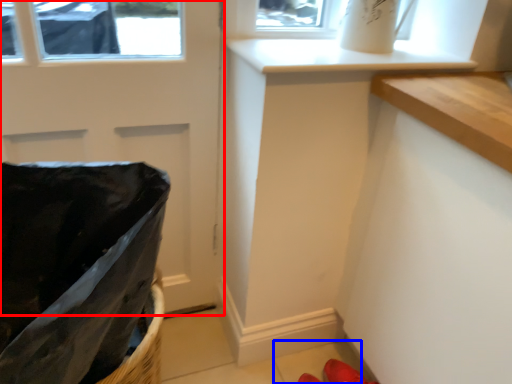
Question: Which object appears farthest to the camera in this image, door (highlighted by a red box) or tile (highlighted by a blue box)?

Choices:
 (A) door
 (B) tile

Answer: (B)